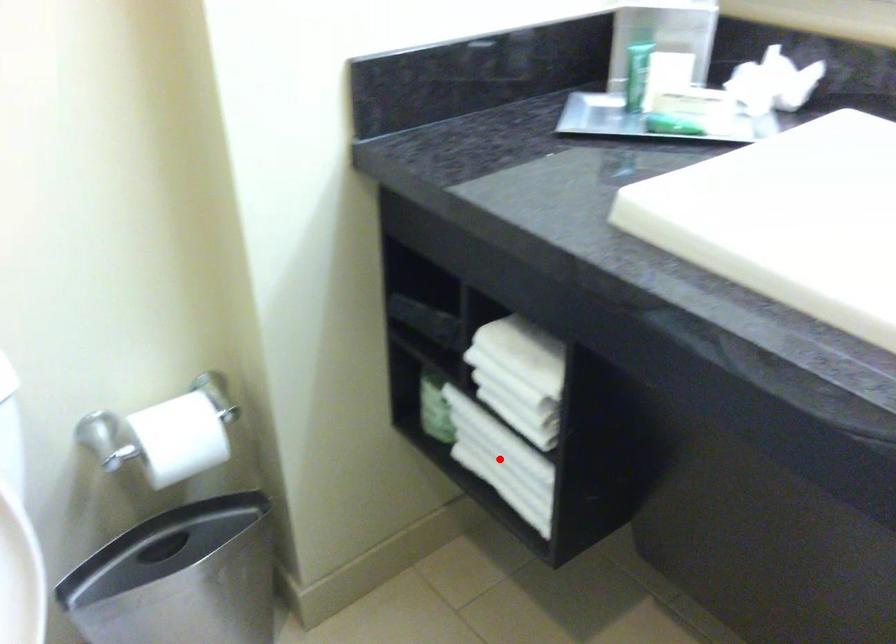
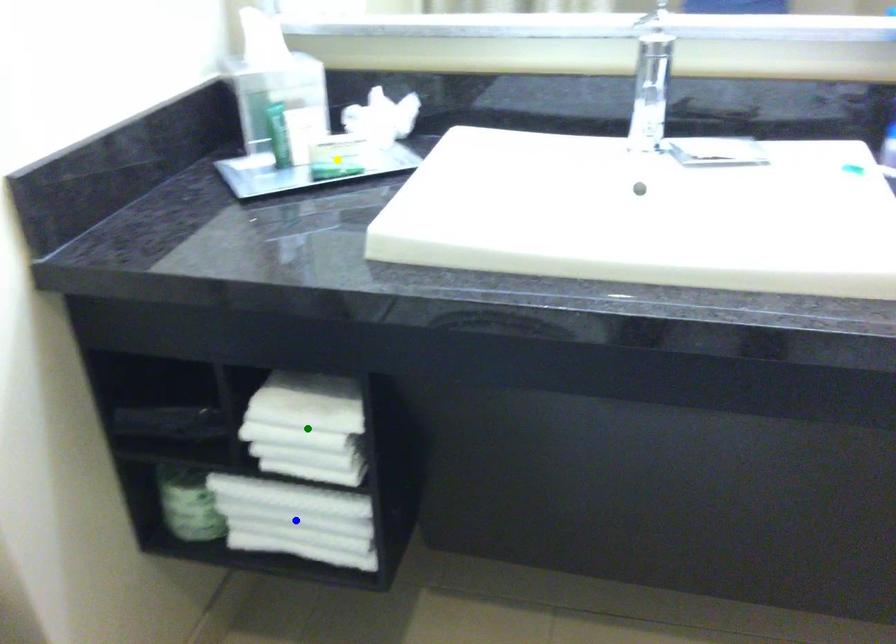
Question: I am providing you with two images of the same scene from different viewpoints. A red point is marked on the first image. You are given multiple points on the second image. Which mark in image 2 goes with the point in image 1?

Choices:
 (A) blue point
 (B) yellow point
 (C) green point

Answer: (A)